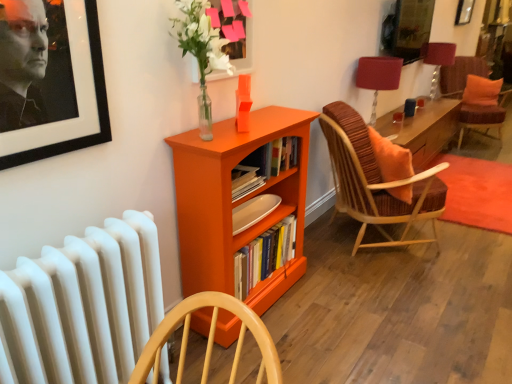
Question: Considering the relative sizes of hardcover books at center and matte red lampshade at upper right, the second table lamp from the top, in the image provided, is hardcover books at center taller than matte red lampshade at upper right, the second table lamp from the top,?

Choices:
 (A) yes
 (B) no

Answer: (B)

Question: Could you tell me if hardcover books at center is turned towards matte red lampshade at upper right, the 1th table lamp from the front?

Choices:
 (A) no
 (B) yes

Answer: (A)

Question: From the image's perspective, is hardcover books at center located beneath matte red lampshade at upper right, which ranks as the first table lamp in bottom-to-top order?

Choices:
 (A) yes
 (B) no

Answer: (A)

Question: Considering the relative positions of hardcover books at center and matte red lampshade at upper right, which ranks as the 2th table lamp in back-to-front order, in the image provided, is hardcover books at center behind matte red lampshade at upper right, which ranks as the 2th table lamp in back-to-front order,?

Choices:
 (A) yes
 (B) no

Answer: (B)

Question: Can you see hardcover books at center touching matte red lampshade at upper right, the second table lamp from the top?

Choices:
 (A) yes
 (B) no

Answer: (B)

Question: Is white matte radiator at lower left inside or outside of hardcover books at center?

Choices:
 (A) inside
 (B) outside

Answer: (B)

Question: Considering the positions of white matte radiator at lower left and hardcover books at center in the image, is white matte radiator at lower left bigger or smaller than hardcover books at center?

Choices:
 (A) small
 (B) big

Answer: (B)

Question: Considering the positions of white matte radiator at lower left and hardcover books at center in the image, is white matte radiator at lower left wider or thinner than hardcover books at center?

Choices:
 (A) thin
 (B) wide

Answer: (A)

Question: Considering the positions of white matte radiator at lower left and hardcover books at center in the image, is white matte radiator at lower left taller or shorter than hardcover books at center?

Choices:
 (A) short
 (B) tall

Answer: (B)

Question: Is point (452, 51) closer or farther from the camera than point (487, 71)?

Choices:
 (A) closer
 (B) farther

Answer: (A)

Question: Considering the relative positions of matte red lampshade at upper right, the 1th table lamp when ordered from top to bottom, and velvet orange cushion at right, the 1th chair positioned from the back, in the image provided, is matte red lampshade at upper right, the 1th table lamp when ordered from top to bottom, to the left or to the right of velvet orange cushion at right, the 1th chair positioned from the back,?

Choices:
 (A) right
 (B) left

Answer: (B)

Question: In terms of size, does matte red lampshade at upper right, the 2th table lamp in the left-to-right sequence, appear bigger or smaller than velvet orange cushion at right, the 1th chair positioned from the back?

Choices:
 (A) big
 (B) small

Answer: (B)

Question: Relative to velvet orange cushion at right, acting as the second chair starting from the bottom, is matte red lampshade at upper right, the 2th table lamp from the bottom, in front or behind?

Choices:
 (A) front
 (B) behind

Answer: (A)

Question: Is point (28, 329) positioned closer to the camera than point (358, 177)?

Choices:
 (A) closer
 (B) farther

Answer: (A)

Question: In the image, is white matte radiator at lower left positioned in front of or behind wooden woven chair with orange cushion at right, which ranks as the first chair in front-to-back order?

Choices:
 (A) front
 (B) behind

Answer: (A)